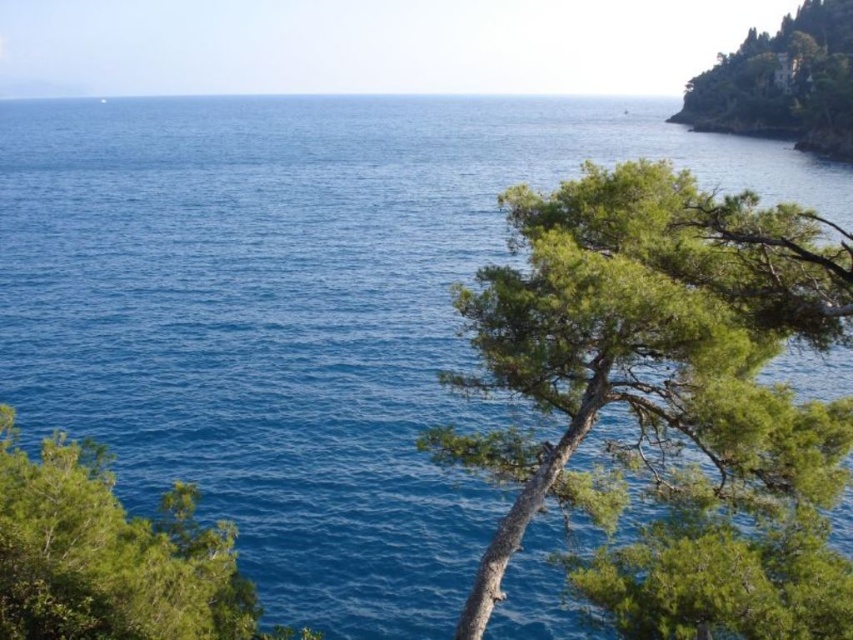
In the scene shown: Can you confirm if green textured tree at right is positioned below green leafy tree at upper right?

Correct, green textured tree at right is located below green leafy tree at upper right.

Does green textured tree at right appear over green leafy tree at upper right?

Actually, green textured tree at right is below green leafy tree at upper right.

Does point (671, 296) come in front of point (750, 81)?

Yes.

Locate an element on the screen. The image size is (853, 640). green textured tree at right is located at coordinates (668, 397).

Can you confirm if green leafy tree at lower left is positioned to the right of green leafy tree at upper right?

In fact, green leafy tree at lower left is to the left of green leafy tree at upper right.

Identify the location of green leafy tree at lower left. (109, 556).

Which is behind, point (656, 461) or point (91, 465)?

Point (91, 465)

Based on the photo, who is more forward, (821, 404) or (67, 513)?

Point (67, 513) is more forward.

Locate an element on the screen. green textured tree at right is located at coordinates (668, 397).